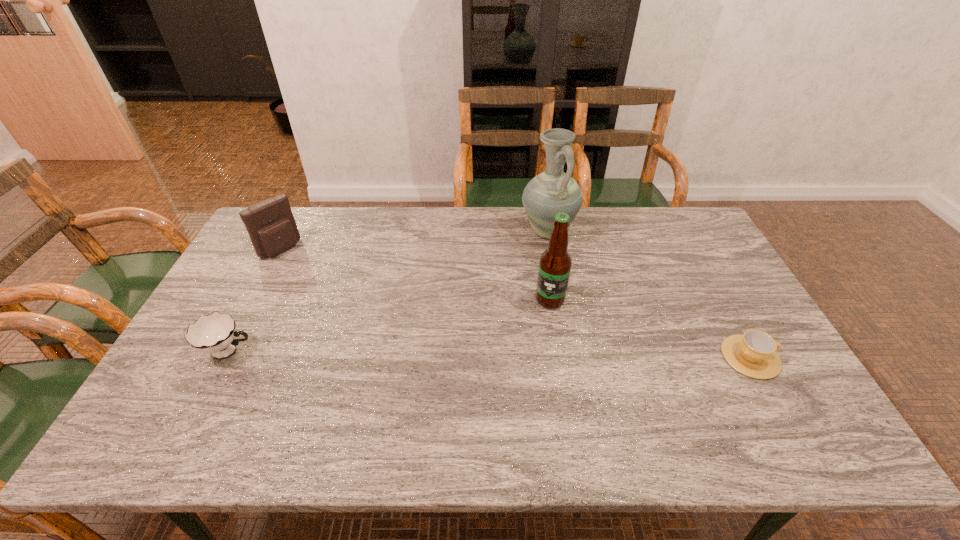
At what (x,y) coordinates should I click in order to perform the action: click on free area in between the taller cup and the tallest object. Please return your answer as a coordinate pair (x, y). The image size is (960, 540). Looking at the image, I should click on (389, 291).

Identify the location of vacant area between the left cup and the fourth shortest object. This screenshot has height=540, width=960. (390, 325).

At what (x,y) coordinates should I click in order to perform the action: click on free space between the pouch and the pitcher. Please return your answer as a coordinate pair (x, y). Looking at the image, I should click on (414, 240).

In order to click on vacant point located between the right cup and the taller cup in this screenshot , I will do `click(490, 354)`.

Find the location of a particular element. The height and width of the screenshot is (540, 960). free area in between the left cup and the third nearest object is located at coordinates (390, 325).

I want to click on vacant point located between the taller cup and the tallest object, so click(x=389, y=291).

Where is `empty space that is in between the pitcher and the taller cup`? empty space that is in between the pitcher and the taller cup is located at coordinates (389, 291).

Find the location of `free space between the pouch and the second shortest object`. free space between the pouch and the second shortest object is located at coordinates (255, 300).

Locate an element on the screen. Image resolution: width=960 pixels, height=540 pixels. empty space that is in between the rightmost object and the pitcher is located at coordinates (649, 294).

Identify which object is located as the fourth nearest to the second shortest object. Please provide its 2D coordinates. Your answer should be formatted as a tuple, i.e. [(x, y)], where the tuple contains the x and y coordinates of a point satisfying the conditions above.

[(753, 354)]